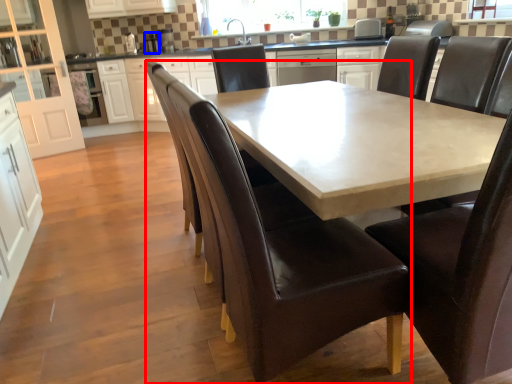
Question: Which object appears farthest to the camera in this image, chair (highlighted by a red box) or appliance (highlighted by a blue box)?

Choices:
 (A) chair
 (B) appliance

Answer: (B)